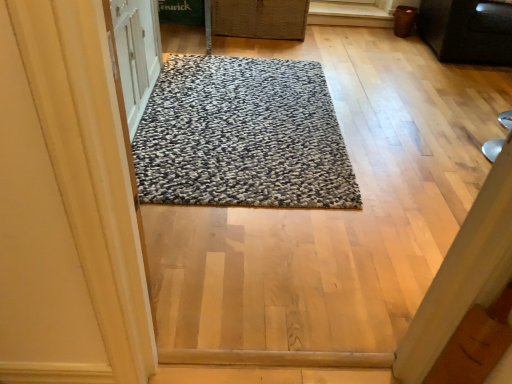
Question: Considering the relative sizes of textured gray rug at center and black matte cabinet at upper right in the image provided, is textured gray rug at center smaller than black matte cabinet at upper right?

Choices:
 (A) yes
 (B) no

Answer: (A)

Question: Does textured gray rug at center turn towards black matte cabinet at upper right?

Choices:
 (A) no
 (B) yes

Answer: (A)

Question: Does textured gray rug at center appear on the left side of black matte cabinet at upper right?

Choices:
 (A) yes
 (B) no

Answer: (A)

Question: Considering the relative sizes of textured gray rug at center and black matte cabinet at upper right in the image provided, is textured gray rug at center wider than black matte cabinet at upper right?

Choices:
 (A) no
 (B) yes

Answer: (B)

Question: Is textured gray rug at center facing away from black matte cabinet at upper right?

Choices:
 (A) no
 (B) yes

Answer: (A)

Question: Based on their sizes in the image, would you say black matte cabinet at upper right is bigger or smaller than textured gray rug at center?

Choices:
 (A) small
 (B) big

Answer: (B)

Question: Does point pos(505,52) appear closer or farther from the camera than point pos(202,193)?

Choices:
 (A) closer
 (B) farther

Answer: (B)

Question: From the image's perspective, is black matte cabinet at upper right positioned above or below textured gray rug at center?

Choices:
 (A) above
 (B) below

Answer: (A)

Question: From a real-world perspective, is black matte cabinet at upper right positioned above or below textured gray rug at center?

Choices:
 (A) below
 (B) above

Answer: (B)

Question: Considering the positions of textured gray rug at center and black matte cabinet at upper right in the image, is textured gray rug at center wider or thinner than black matte cabinet at upper right?

Choices:
 (A) thin
 (B) wide

Answer: (B)

Question: From a real-world perspective, is textured gray rug at center above or below black matte cabinet at upper right?

Choices:
 (A) below
 (B) above

Answer: (A)

Question: Is textured gray rug at center situated inside black matte cabinet at upper right or outside?

Choices:
 (A) inside
 (B) outside

Answer: (B)

Question: From the image's perspective, relative to black matte cabinet at upper right, is textured gray rug at center above or below?

Choices:
 (A) above
 (B) below

Answer: (B)

Question: Is woven brown basket at upper center bigger or smaller than black matte cabinet at upper right?

Choices:
 (A) small
 (B) big

Answer: (A)

Question: In the image, is woven brown basket at upper center positioned in front of or behind black matte cabinet at upper right?

Choices:
 (A) front
 (B) behind

Answer: (B)